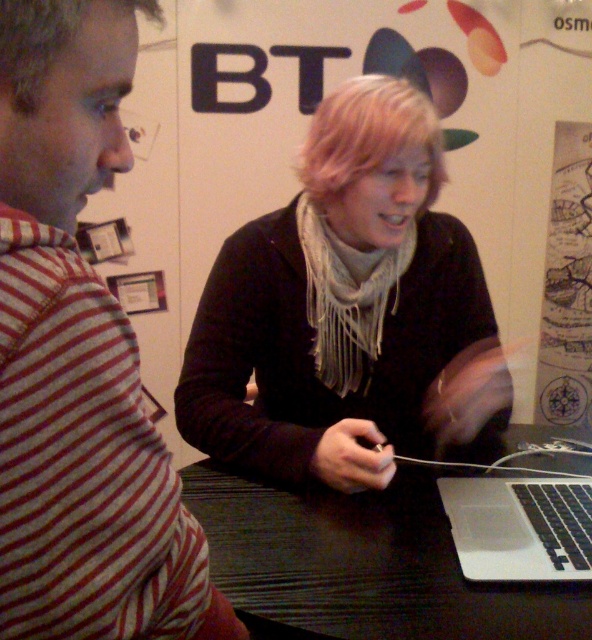
Question: Can you confirm if blondehair at center is wider than blondehair at left?

Choices:
 (A) yes
 (B) no

Answer: (A)

Question: From the image, what is the correct spatial relationship of black matte scarf at center in relation to blondehair at center?

Choices:
 (A) below
 (B) above

Answer: (A)

Question: Estimate the real-world distances between objects in this image. Which object is farther from the silver metallic laptop at lower right?

Choices:
 (A) blondehair at left
 (B) striped fabric shirt at left
 (C) black wood table at center

Answer: (A)

Question: Among these objects, which one is farthest from the camera?

Choices:
 (A) black matte scarf at center
 (B) black wood table at center
 (C) blondehair at center
 (D) striped fabric shirt at left

Answer: (C)

Question: Can you confirm if silver metallic laptop at lower right is thinner than blondehair at left?

Choices:
 (A) no
 (B) yes

Answer: (A)

Question: Which point is farther from the camera taking this photo?

Choices:
 (A) (471, 467)
 (B) (422, 596)

Answer: (A)